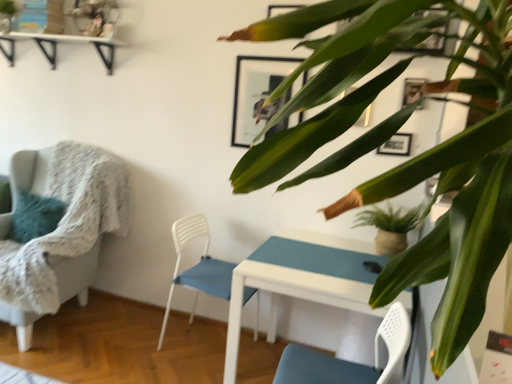
Question: Can we say white plastic chair at center, marked as the second chair in a left-to-right arrangement, lies outside white glossy table at center?

Choices:
 (A) yes
 (B) no

Answer: (A)

Question: Does white plastic chair at center, marked as the second chair in a left-to-right arrangement, have a lesser height compared to white glossy table at center?

Choices:
 (A) yes
 (B) no

Answer: (B)

Question: Is white plastic chair at center, positioned as the 1th chair in right-to-left order, smaller than white glossy table at center?

Choices:
 (A) no
 (B) yes

Answer: (B)

Question: Are white plastic chair at center, marked as the second chair in a left-to-right arrangement, and white glossy table at center making contact?

Choices:
 (A) no
 (B) yes

Answer: (A)

Question: From a real-world perspective, is white plastic chair at center, positioned as the 1th chair in right-to-left order, positioned under white glossy table at center based on gravity?

Choices:
 (A) yes
 (B) no

Answer: (B)

Question: Does white plastic chair at center, positioned as the 1th chair in right-to-left order, have a greater height compared to white glossy table at center?

Choices:
 (A) yes
 (B) no

Answer: (A)

Question: Considering the relative sizes of white plastic chair at center, marked as the second chair in a left-to-right arrangement, and green glossy leafy plant at upper right, which is counted as the second houseplant, starting from the back, in the image provided, is white plastic chair at center, marked as the second chair in a left-to-right arrangement, shorter than green glossy leafy plant at upper right, which is counted as the second houseplant, starting from the back,?

Choices:
 (A) no
 (B) yes

Answer: (A)

Question: Is white plastic chair at center, marked as the second chair in a left-to-right arrangement, positioned before green glossy leafy plant at upper right, which is counted as the second houseplant, starting from the back?

Choices:
 (A) no
 (B) yes

Answer: (A)

Question: From the image's perspective, is white plastic chair at center, positioned as the 1th chair in right-to-left order, on top of green glossy leafy plant at upper right, which is counted as the second houseplant, starting from the back?

Choices:
 (A) yes
 (B) no

Answer: (B)

Question: Can you confirm if white plastic chair at center, marked as the second chair in a left-to-right arrangement, is smaller than green glossy leafy plant at upper right, positioned as the first houseplant in left-to-right order?

Choices:
 (A) no
 (B) yes

Answer: (B)

Question: Does white plastic chair at center, positioned as the 1th chair in right-to-left order, contain green glossy leafy plant at upper right, which is counted as the second houseplant, starting from the back?

Choices:
 (A) yes
 (B) no

Answer: (B)

Question: Does white plastic chair at center, positioned as the 1th chair in right-to-left order, appear on the right side of green glossy leafy plant at upper right, which is counted as the second houseplant, starting from the back?

Choices:
 (A) no
 (B) yes

Answer: (A)

Question: Does white glossy table at center have a greater width compared to green glossy leafy plant at upper right, positioned as the first houseplant in left-to-right order?

Choices:
 (A) no
 (B) yes

Answer: (B)